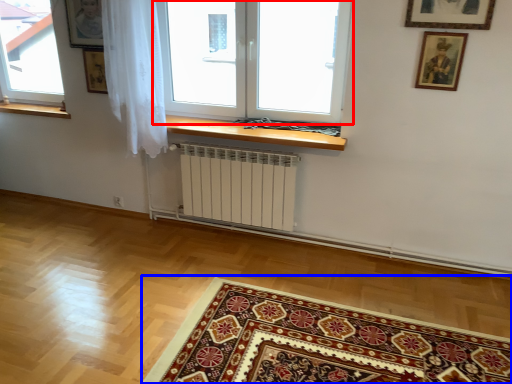
Question: Which object appears closest to the camera in this image, window (highlighted by a red box) or mat (highlighted by a blue box)?

Choices:
 (A) window
 (B) mat

Answer: (B)